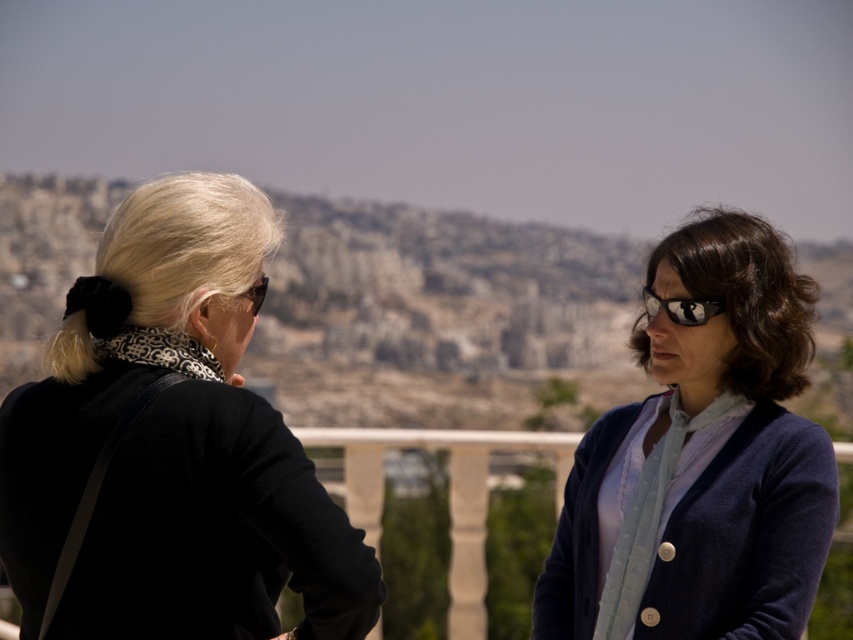
Can you confirm if black matte jacket at upper left is positioned to the left of blue cardigan at right?

Correct, you'll find black matte jacket at upper left to the left of blue cardigan at right.

Can you confirm if black matte jacket at upper left is positioned below blue cardigan at right?

Yes, black matte jacket at upper left is below blue cardigan at right.

Which is behind, point (135, 480) or point (769, 276)?

The point (769, 276) is more distant.

You are a GUI agent. You are given a task and a screenshot of the screen. Output one action in this format:
    pyautogui.click(x=<x>, y=<y>)
    Task: Click on the black matte jacket at upper left
    
    Given the screenshot: What is the action you would take?
    pyautogui.click(x=172, y=445)

Measure the distance from black matte jacket at upper left to matte black goggles at upper left.

127.10 feet

Image resolution: width=853 pixels, height=640 pixels. Describe the element at coordinates (172, 445) in the screenshot. I see `black matte jacket at upper left` at that location.

The height and width of the screenshot is (640, 853). What do you see at coordinates (172, 445) in the screenshot?
I see `black matte jacket at upper left` at bounding box center [172, 445].

Identify the location of black matte jacket at upper left. (172, 445).

Measure the distance between black matte jacket at upper left and camera.

They are 350.12 meters apart.

Which is more to the right, black matte jacket at upper left or matte black goggles at right?

matte black goggles at right is more to the right.

Measure the distance between black matte jacket at upper left and camera.

black matte jacket at upper left and camera are 350.12 meters apart from each other.

The height and width of the screenshot is (640, 853). I want to click on black matte jacket at upper left, so click(172, 445).